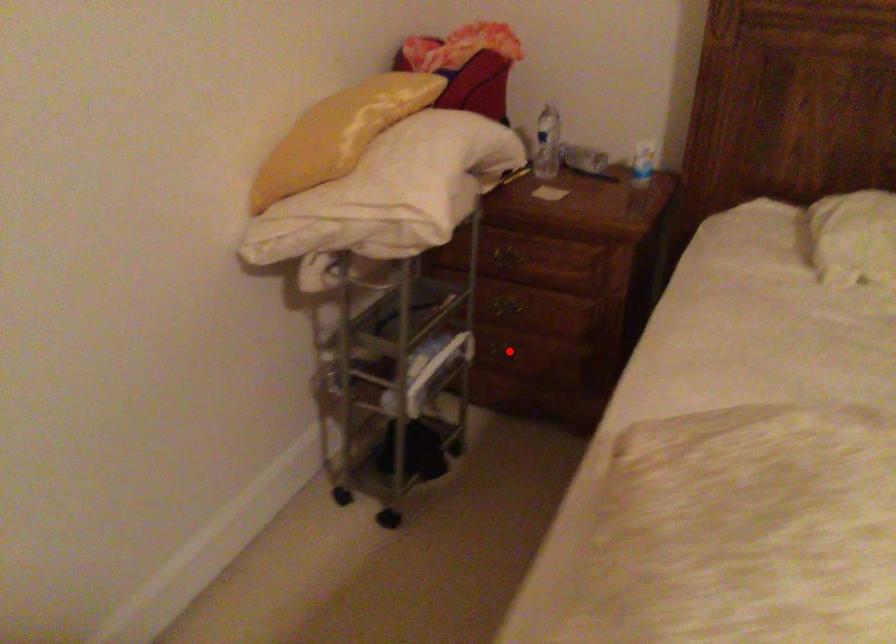
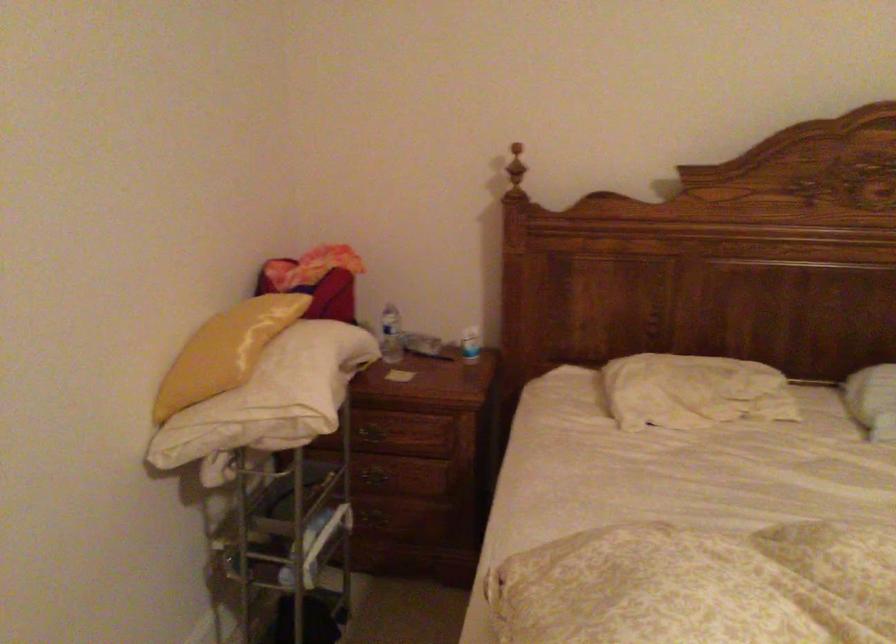
Question: I am providing you with two images of the same scene from different viewpoints. A red point is shown in image1. For the corresponding object point in image2, is it positioned nearer or farther from the camera?

Choices:
 (A) Nearer
 (B) Farther

Answer: (B)